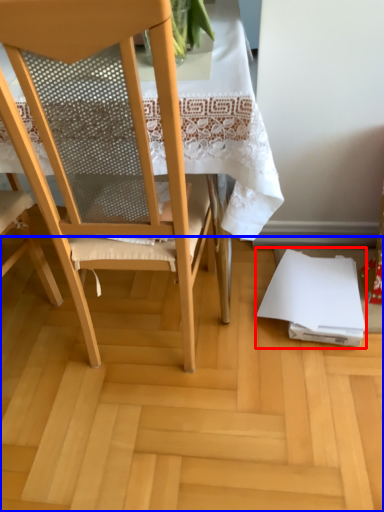
Question: Which of the following is the closest to the observer, notebook (highlighted by a red box) or plywood (highlighted by a blue box)?

Choices:
 (A) notebook
 (B) plywood

Answer: (B)